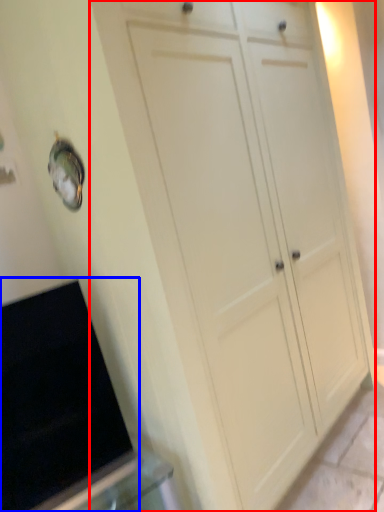
Question: Among these objects, which one is farthest to the camera, cupboard (highlighted by a red box) or appliance (highlighted by a blue box)?

Choices:
 (A) cupboard
 (B) appliance

Answer: (B)